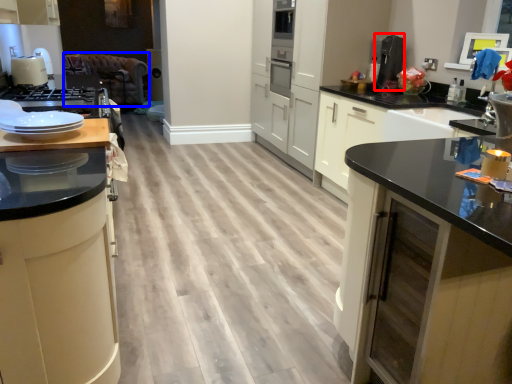
Question: Which object is further to the camera taking this photo, coffee machine (highlighted by a red box) or brown (highlighted by a blue box)?

Choices:
 (A) coffee machine
 (B) brown

Answer: (B)